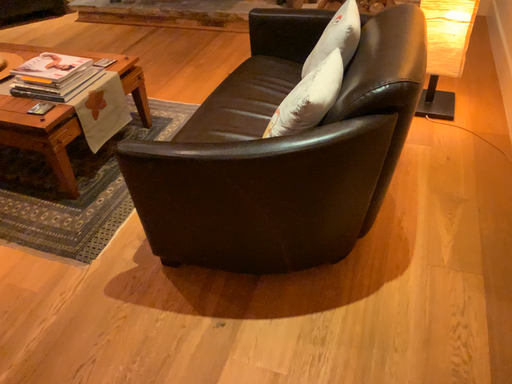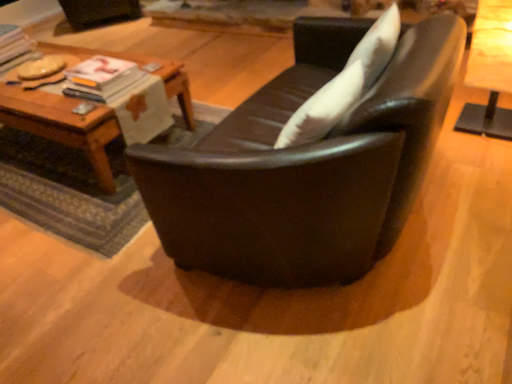
Question: How did the camera likely rotate when shooting the video?

Choices:
 (A) rotated right
 (B) rotated left

Answer: (B)